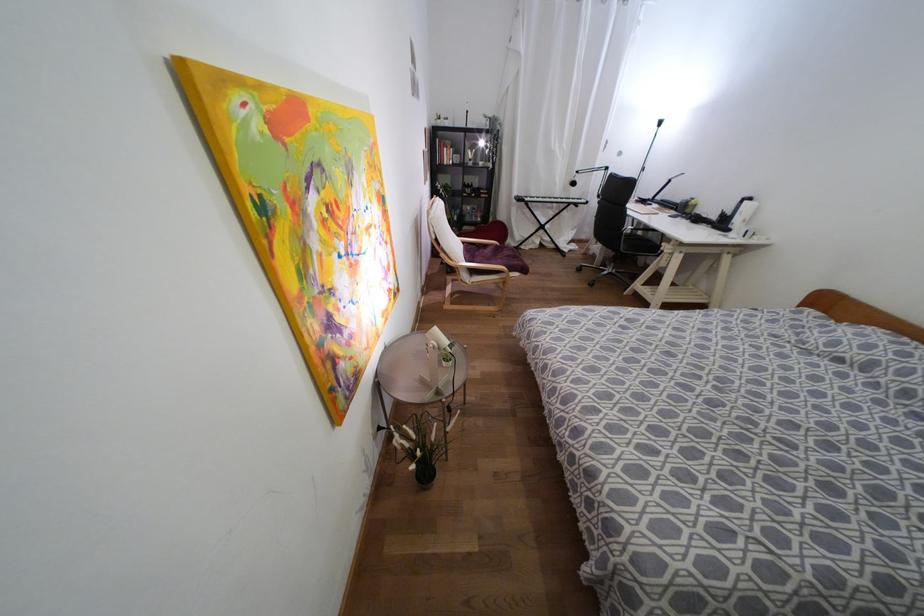
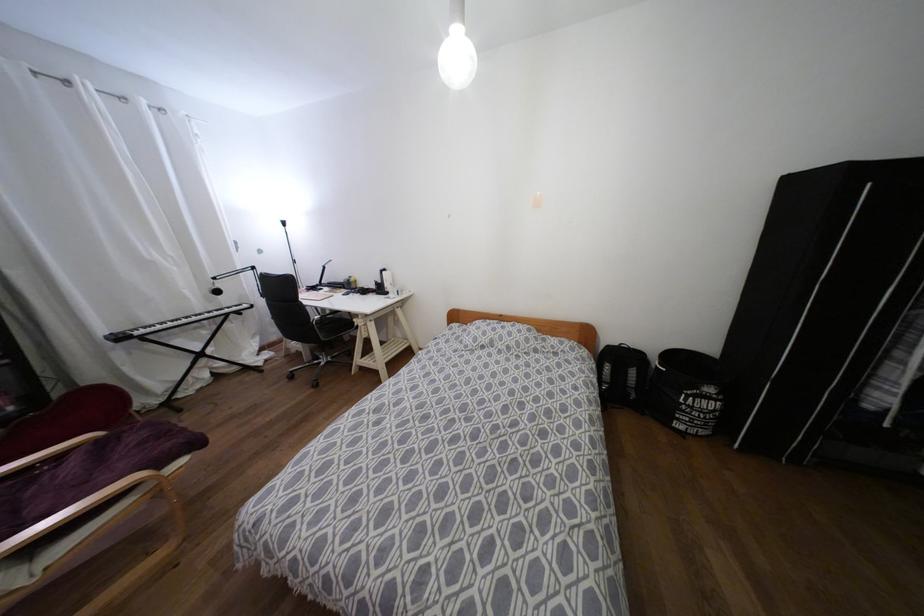
Question: The camera is either moving clockwise (left) or counter-clockwise (right) around the object. The first image is from the beginning of the video and the second image is from the end. Is the camera moving left or right when shooting the video?

Choices:
 (A) Left
 (B) Right

Answer: (A)